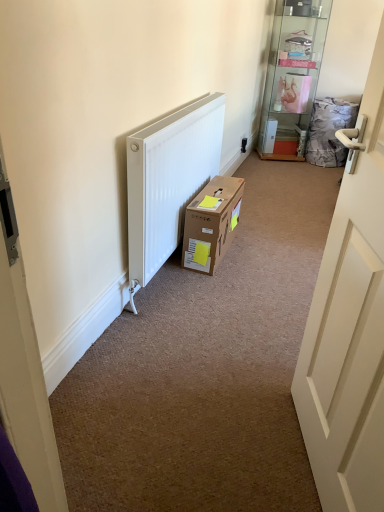
In order to face white matte door at right, should I rotate leftwards or rightwards?

Turn right approximately 22.895 degrees to face it.

Locate an element on the screen. clear glass shelf at upper right is located at coordinates (292, 77).

The image size is (384, 512). Describe the element at coordinates (243, 144) in the screenshot. I see `black plastic electric outlet at upper right` at that location.

The image size is (384, 512). Find the location of `brown cardboard box at center`. brown cardboard box at center is located at coordinates (211, 223).

From a real-world perspective, is clear glass shelf at upper right physically located above or below black plastic electric outlet at upper right?

From a real-world perspective, clear glass shelf at upper right is physically above black plastic electric outlet at upper right.

Is clear glass shelf at upper right outside of black plastic electric outlet at upper right?

Yes, clear glass shelf at upper right is not within black plastic electric outlet at upper right.

Is clear glass shelf at upper right turned away from black plastic electric outlet at upper right?

No, clear glass shelf at upper right's orientation is not away from black plastic electric outlet at upper right.

Is black plastic electric outlet at upper right inside or outside of brown cardboard box at center?

The correct answer is: outside.

From the image's perspective, relative to brown cardboard box at center, is black plastic electric outlet at upper right above or below?

black plastic electric outlet at upper right is situated higher than brown cardboard box at center in the image.

Is black plastic electric outlet at upper right facing towards brown cardboard box at center?

No, black plastic electric outlet at upper right is not facing towards brown cardboard box at center.

From a real-world perspective, is brown cardboard box at center below black plastic electric outlet at upper right?

No, from a real-world perspective, brown cardboard box at center is not under black plastic electric outlet at upper right.

Is brown cardboard box at center oriented towards black plastic electric outlet at upper right?

No, brown cardboard box at center is not facing towards black plastic electric outlet at upper right.

From the image's perspective, would you say brown cardboard box at center is positioned over black plastic electric outlet at upper right?

No, from the image's perspective, brown cardboard box at center is not on top of black plastic electric outlet at upper right.

Is brown cardboard box at center bigger or smaller than black plastic electric outlet at upper right?

brown cardboard box at center is bigger than black plastic electric outlet at upper right.

Is white matte door at right inside brown cardboard box at center?

No.

From the image's perspective, is brown cardboard box at center positioned above or below white matte door at right?

brown cardboard box at center is above white matte door at right.

Could you tell me if brown cardboard box at center is turned towards white matte door at right?

No, brown cardboard box at center is not facing towards white matte door at right.

What's the angular difference between brown cardboard box at center and white matte door at right's facing directions?

They differ by 159 degrees in their facing directions.

Is white matte door at right taller than clear glass shelf at upper right?

Incorrect, the height of white matte door at right is not larger of that of clear glass shelf at upper right.

Between white matte door at right and clear glass shelf at upper right, which one is positioned in front?

white matte door at right is in front.

From a real-world perspective, which is physically below, white matte door at right or clear glass shelf at upper right?

In real-world perspective, white matte door at right is lower.

Which is nearer, (347, 314) or (305, 121)?

The point (347, 314) is in front.

Is clear glass shelf at upper right not near brown cardboard box at center?

Yes, clear glass shelf at upper right is far from brown cardboard box at center.

From a real-world perspective, is clear glass shelf at upper right physically located above or below brown cardboard box at center?

clear glass shelf at upper right is above brown cardboard box at center.

From the image's perspective, which one is positioned higher, clear glass shelf at upper right or brown cardboard box at center?

clear glass shelf at upper right appears higher in the image.

Based on the photo, which is farther from the camera, (268, 65) or (203, 256)?

The point (268, 65) is more distant.

Which is more to the left, brown cardboard box at center or clear glass shelf at upper right?

From the viewer's perspective, brown cardboard box at center appears more on the left side.

In terms of height, does brown cardboard box at center look taller or shorter compared to clear glass shelf at upper right?

Clearly, brown cardboard box at center is shorter compared to clear glass shelf at upper right.

Identify the location of box below the clear glass shelf at upper right (from the image's perspective). The height and width of the screenshot is (512, 384). (211, 223).

Is brown cardboard box at center turned away from clear glass shelf at upper right?

No, clear glass shelf at upper right is not at the back of brown cardboard box at center.

I want to click on shelf above the black plastic electric outlet at upper right (from the image's perspective), so click(x=292, y=77).

Find the location of a particular element. The image size is (384, 512). box that appears in front of the black plastic electric outlet at upper right is located at coordinates (211, 223).

Estimate the real-world distances between objects in this image. Which object is closer to black plastic electric outlet at upper right, white matte door at right or brown cardboard box at center?

brown cardboard box at center lies closer to black plastic electric outlet at upper right than the other object.

When comparing their distances from white matte door at right, does brown cardboard box at center or clear glass shelf at upper right seem closer?

brown cardboard box at center is closer to white matte door at right.

Based on the photo, when comparing their distances from white matte door at right, does clear glass shelf at upper right or black plastic electric outlet at upper right seem closer?

black plastic electric outlet at upper right.

Which object lies further to the anchor point clear glass shelf at upper right, white matte door at right or brown cardboard box at center?

white matte door at right is positioned further to the anchor clear glass shelf at upper right.

Which object lies further to the anchor point clear glass shelf at upper right, white matte door at right or black plastic electric outlet at upper right?

white matte door at right is further to clear glass shelf at upper right.

From the image, which object appears to be nearer to black plastic electric outlet at upper right, brown cardboard box at center or clear glass shelf at upper right?

Among the two, clear glass shelf at upper right is located nearer to black plastic electric outlet at upper right.

From the image, which object appears to be nearer to black plastic electric outlet at upper right, clear glass shelf at upper right or brown cardboard box at center?

clear glass shelf at upper right lies closer to black plastic electric outlet at upper right than the other object.

Estimate the real-world distances between objects in this image. Which object is closer to brown cardboard box at center, clear glass shelf at upper right or white matte door at right?

white matte door at right is closer to brown cardboard box at center.

The width and height of the screenshot is (384, 512). I want to click on shelf between white matte door at right and black plastic electric outlet at upper right in the front-back direction, so click(x=292, y=77).

The width and height of the screenshot is (384, 512). I want to click on box between white matte door at right and black plastic electric outlet at upper right along the z-axis, so click(211, 223).

Where is `shelf located between brown cardboard box at center and black plastic electric outlet at upper right in the depth direction`? This screenshot has width=384, height=512. shelf located between brown cardboard box at center and black plastic electric outlet at upper right in the depth direction is located at coordinates (292, 77).

Identify the location of box positioned between white matte door at right and clear glass shelf at upper right from near to far. This screenshot has height=512, width=384. (211, 223).